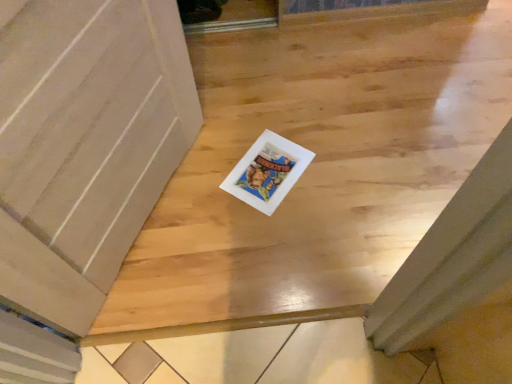
At what (x,y) coordinates should I click in order to perform the action: click on matte white door at center. Please return your answer as a coordinate pair (x, y). The image size is (512, 384). Looking at the image, I should click on (86, 144).

This screenshot has height=384, width=512. What do you see at coordinates (86, 144) in the screenshot? I see `matte white door at center` at bounding box center [86, 144].

Find the location of `matte white door at center`. matte white door at center is located at coordinates (86, 144).